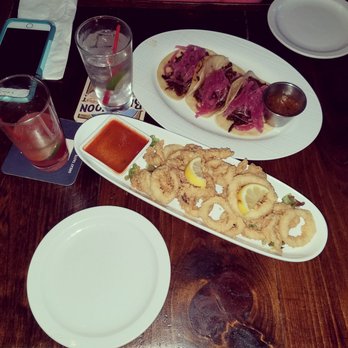
Where is `napkin`? The height and width of the screenshot is (348, 348). napkin is located at coordinates (54, 68).